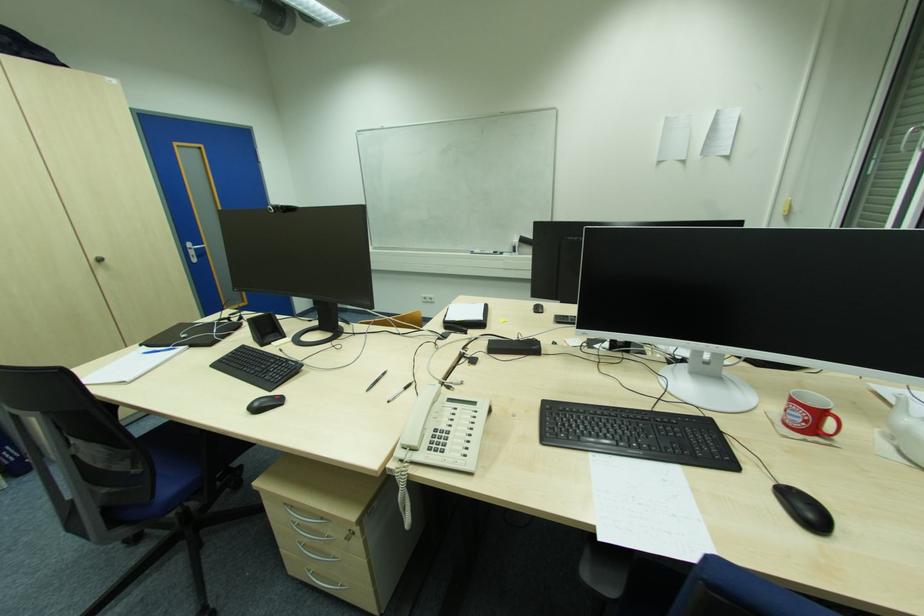
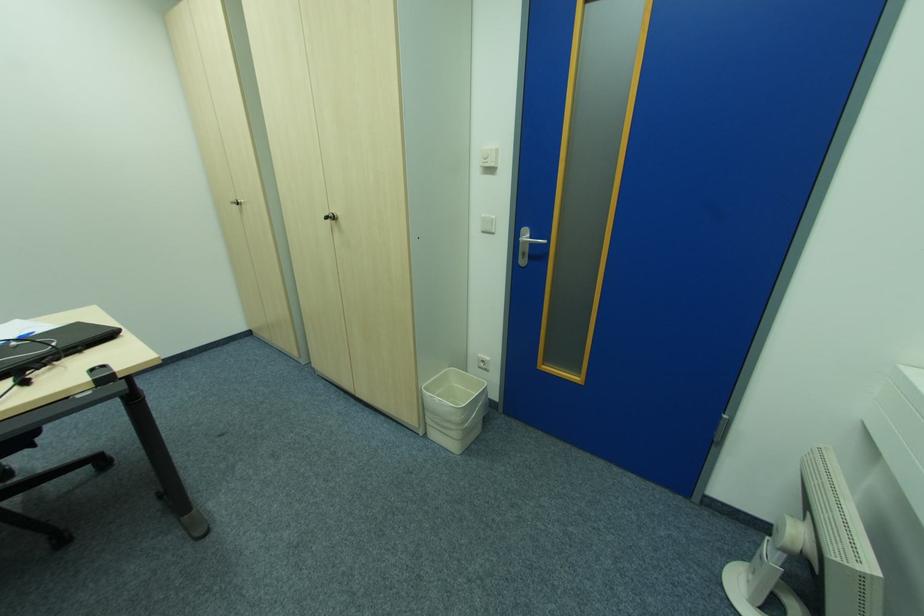
Where in the second image is the point corresponding to the point at 103,261 from the first image?

(334, 219)